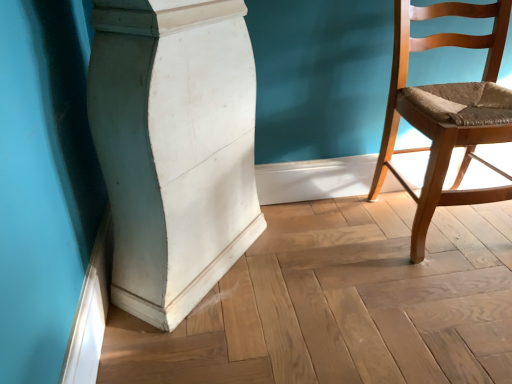
Question: Is light brown wooden chair at right behind white matte/wooden pillar at center?

Choices:
 (A) yes
 (B) no

Answer: (A)

Question: Does light brown wooden chair at right have a smaller size compared to white matte/wooden pillar at center?

Choices:
 (A) yes
 (B) no

Answer: (A)

Question: Is light brown wooden chair at right not near white matte/wooden pillar at center?

Choices:
 (A) yes
 (B) no

Answer: (B)

Question: Is light brown wooden chair at right in front of white matte/wooden pillar at center?

Choices:
 (A) no
 (B) yes

Answer: (A)

Question: From the image's perspective, would you say light brown wooden chair at right is positioned over white matte/wooden pillar at center?

Choices:
 (A) no
 (B) yes

Answer: (B)

Question: Is light brown wooden chair at right aimed at white matte/wooden pillar at center?

Choices:
 (A) no
 (B) yes

Answer: (A)

Question: Considering the relative sizes of white matte/wooden pillar at center and light brown wooden chair at right in the image provided, is white matte/wooden pillar at center bigger than light brown wooden chair at right?

Choices:
 (A) no
 (B) yes

Answer: (B)

Question: Is white matte/wooden pillar at center positioned with its back to light brown wooden chair at right?

Choices:
 (A) yes
 (B) no

Answer: (B)

Question: From the image's perspective, would you say white matte/wooden pillar at center is positioned over light brown wooden chair at right?

Choices:
 (A) no
 (B) yes

Answer: (A)

Question: Is white matte/wooden pillar at center in front of light brown wooden chair at right?

Choices:
 (A) no
 (B) yes

Answer: (B)

Question: Considering the relative positions of white matte/wooden pillar at center and light brown wooden chair at right in the image provided, is white matte/wooden pillar at center to the right of light brown wooden chair at right from the viewer's perspective?

Choices:
 (A) yes
 (B) no

Answer: (B)

Question: Could you tell me if white matte/wooden pillar at center is facing light brown wooden chair at right?

Choices:
 (A) yes
 (B) no

Answer: (A)

Question: From their relative heights in the image, would you say white matte/wooden pillar at center is taller or shorter than light brown wooden chair at right?

Choices:
 (A) short
 (B) tall

Answer: (B)